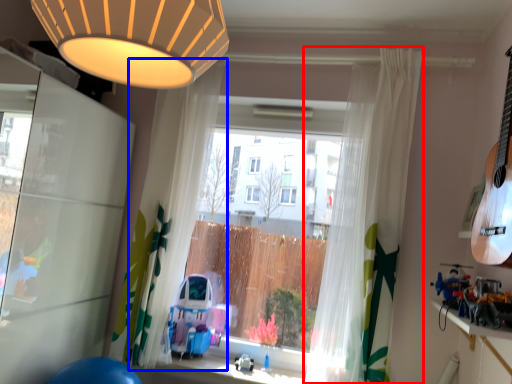
Question: Which object is closer to the camera taking this photo, curtain (highlighted by a red box) or curtain (highlighted by a blue box)?

Choices:
 (A) curtain
 (B) curtain

Answer: (A)